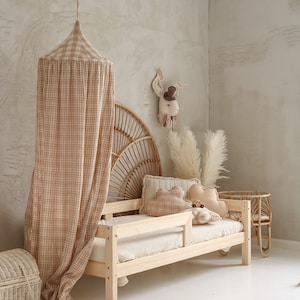
Find the location of `wicker side table`. wicker side table is located at coordinates (257, 216).